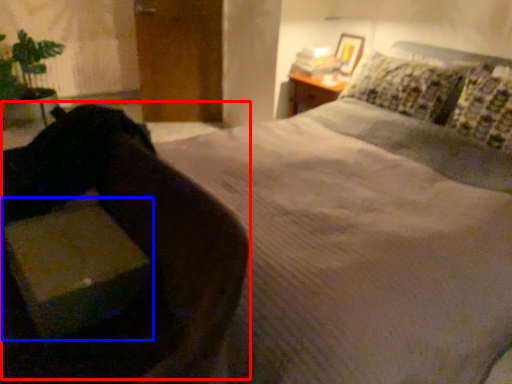
Question: Which object is further to the camera taking this photo, swivel chair (highlighted by a red box) or cardboard box (highlighted by a blue box)?

Choices:
 (A) swivel chair
 (B) cardboard box

Answer: (B)